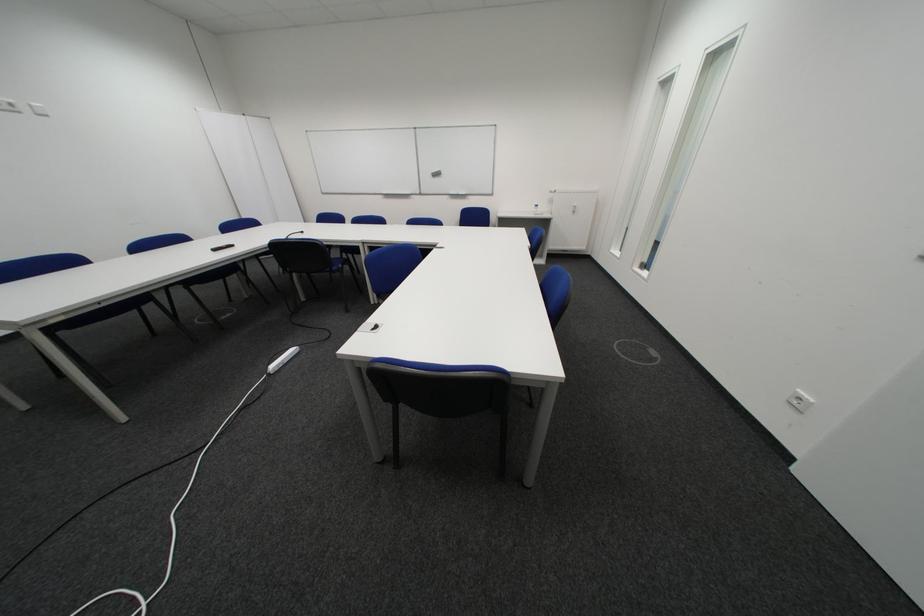
Find where to lift the whiteboard eraser. Please return your answer as a coordinate pair (x, y).

(435, 174)